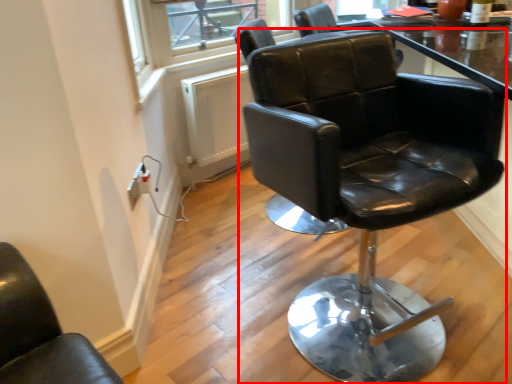
Question: From the image's perspective, where is chair (annotated by the red box) located in relation to window screen in the image?

Choices:
 (A) below
 (B) above

Answer: (A)